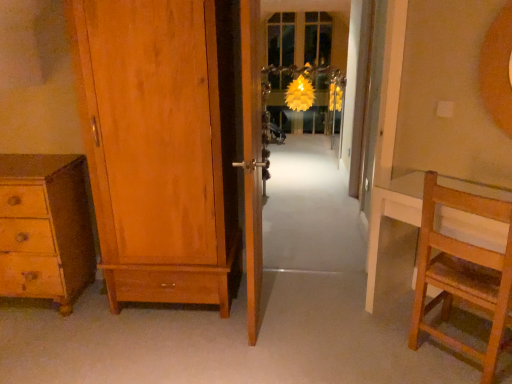
Question: Is translucent glass screen door at center to the left or to the right of wooden door at center, the 1th door in the right-to-left sequence, in the image?

Choices:
 (A) left
 (B) right

Answer: (B)

Question: From a real-world perspective, is translucent glass screen door at center positioned above or below wooden door at center, the 1th door in the right-to-left sequence?

Choices:
 (A) above
 (B) below

Answer: (B)

Question: Which of these objects is positioned farthest from the matte wood wardrobe at left, which appears as the 2th door when viewed from the right?

Choices:
 (A) wooden floor at center, the first path when ordered from bottom to top
 (B) translucent glass screen door at center
 (C) white carpet at center, which is the 2th path from bottom to top
 (D) light brown wooden chair at right
 (E) wooden chest of drawers at lower left

Answer: (C)

Question: Based on their relative distances, which object is nearer to the light brown wooden chair at right?

Choices:
 (A) wooden door at center, acting as the second door starting from the left
 (B) translucent glass screen door at center
 (C) wooden floor at center, the first path when ordered from bottom to top
 (D) white carpet at center, the first path from the top
 (E) wooden chest of drawers at lower left

Answer: (C)